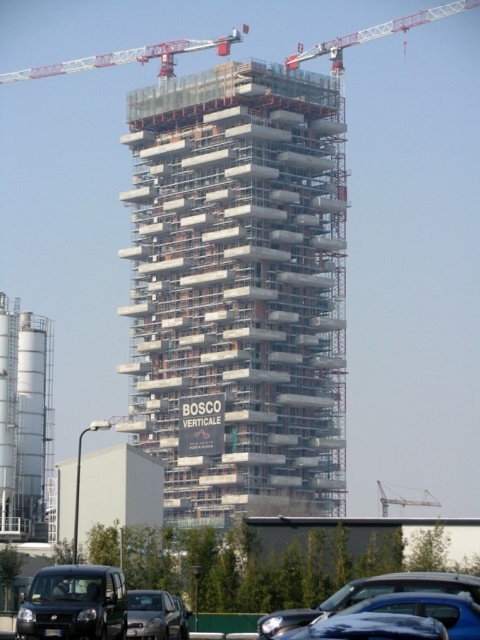
Can you confirm if concrete scaffolding at center is taller than metallic gray crane at center?

Yes, concrete scaffolding at center is taller than metallic gray crane at center.

Which is in front, point (207, 360) or point (402, 504)?

Point (207, 360) is in front.

Where is `concrete scaffolding at center`? This screenshot has width=480, height=640. concrete scaffolding at center is located at coordinates (239, 288).

Measure the distance between white metal crane at upper center and camera.

white metal crane at upper center and camera are 199.00 meters apart from each other.

Which is below, white metal crane at upper center or metallic gray crane at center?

metallic gray crane at center

This screenshot has height=640, width=480. Describe the element at coordinates (130, 58) in the screenshot. I see `white metal crane at upper center` at that location.

Image resolution: width=480 pixels, height=640 pixels. I want to click on white metal crane at upper center, so click(x=130, y=58).

Is point (36, 468) positioned after point (445, 13)?

No, it is in front of (445, 13).

Is metallic silo at left in front of metallic red crane at upper right?

Yes, metallic silo at left is closer to the viewer.

What do you see at coordinates (24, 420) in the screenshot?
I see `metallic silo at left` at bounding box center [24, 420].

This screenshot has height=640, width=480. Identify the location of metallic silo at left. (24, 420).